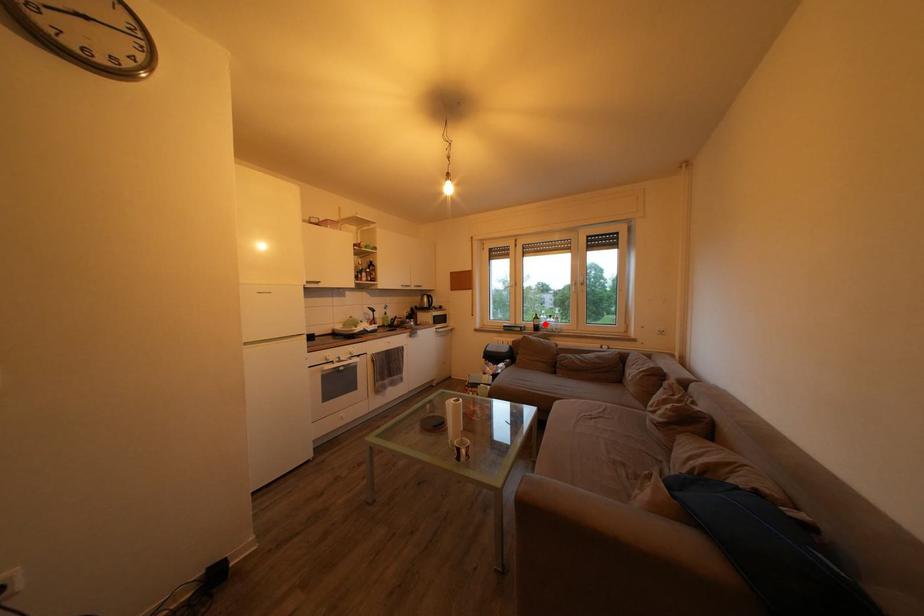
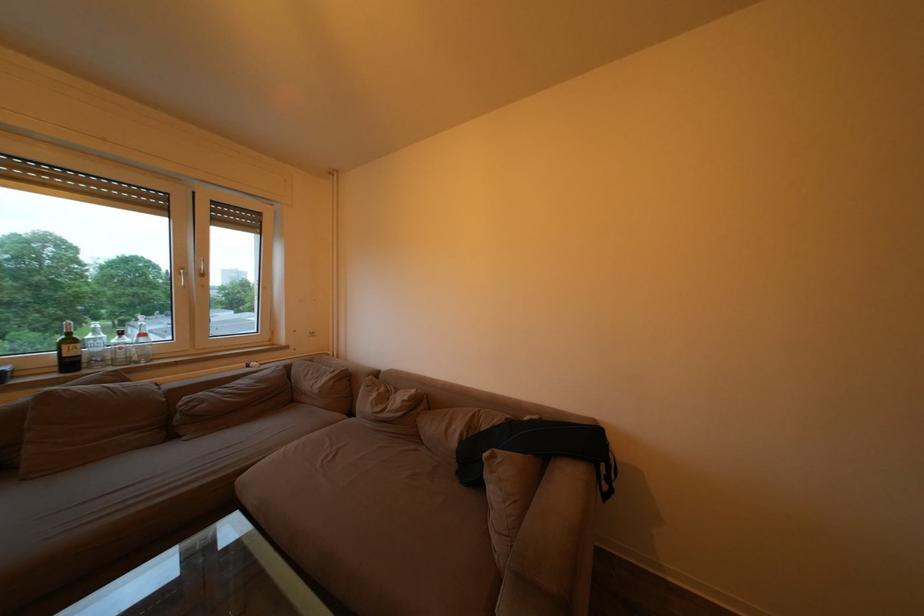
The point at the highlighted location is marked in the first image. Where is the corresponding point in the second image?

(79, 347)